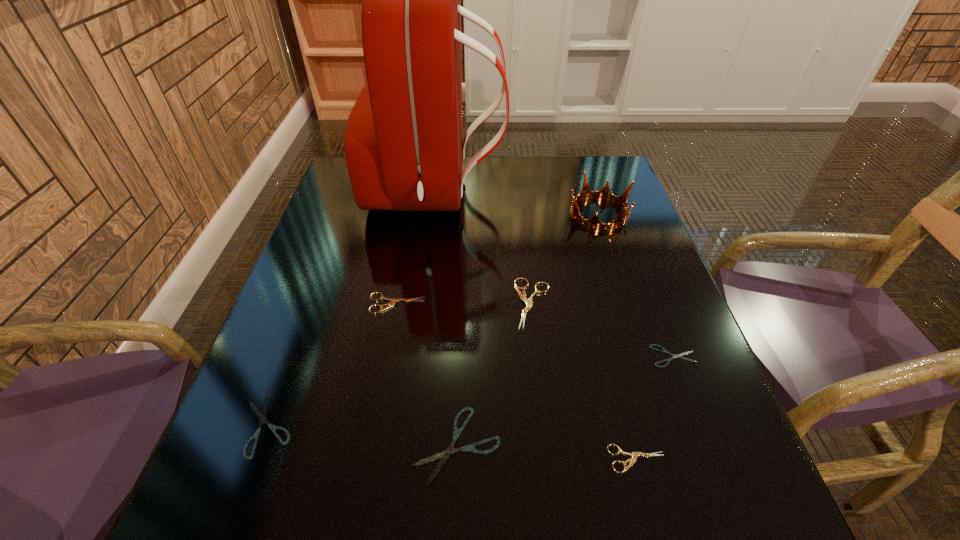
I want to click on free spot located on the right of the biggest black shears, so click(657, 445).

This screenshot has height=540, width=960. Identify the location of free location located on the left of the nearest beige shears. (437, 458).

Identify the location of vacant area situated on the right of the leftmost shears. (475, 426).

Where is `vacant space located on the left of the rightmost black shears`? Image resolution: width=960 pixels, height=540 pixels. vacant space located on the left of the rightmost black shears is located at coordinates (508, 356).

Find the location of `backpack present at the far edge`. backpack present at the far edge is located at coordinates (404, 149).

The image size is (960, 540). What are the coordinates of `crown that is positioned at the far edge` in the screenshot? It's located at (605, 193).

The width and height of the screenshot is (960, 540). What are the coordinates of `object that is positioned at the near edge` in the screenshot? It's located at (444, 455).

Locate an element on the screen. Image resolution: width=960 pixels, height=540 pixels. backpack situated at the left edge is located at coordinates 404,149.

Where is `shears at the left edge`? The height and width of the screenshot is (540, 960). shears at the left edge is located at coordinates (262, 416).

Find the location of a particular element. This screenshot has height=540, width=960. crown that is at the right edge is located at coordinates (605, 193).